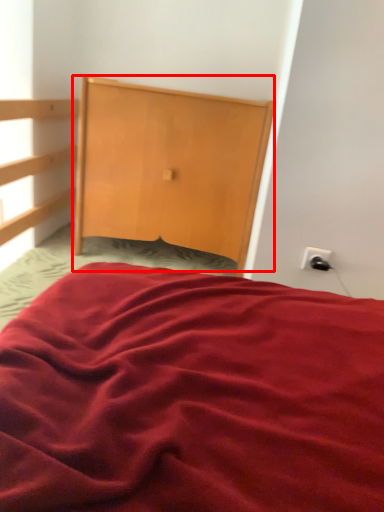
Question: From the image's perspective, where is dresser (annotated by the red box) located in relation to electric outlet in the image?

Choices:
 (A) below
 (B) above

Answer: (B)